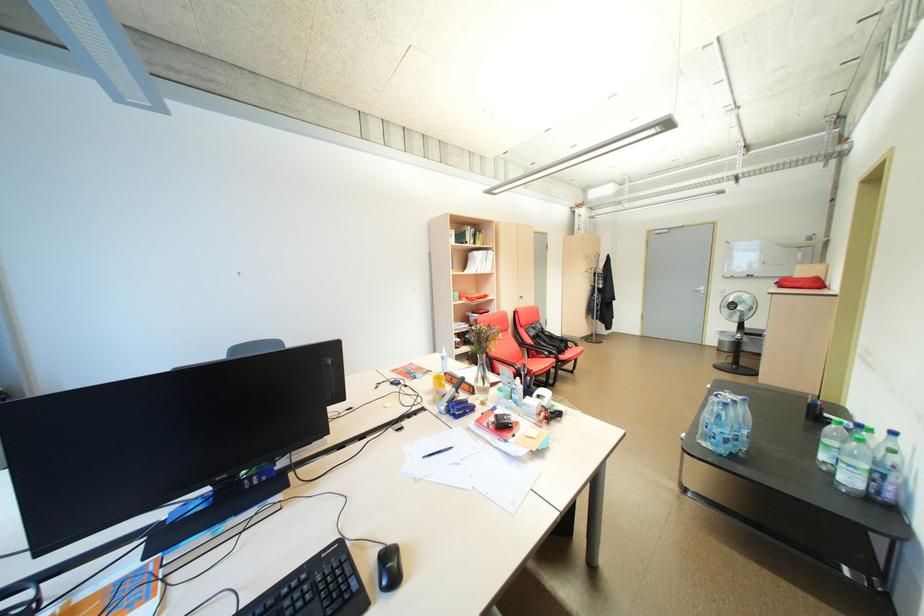
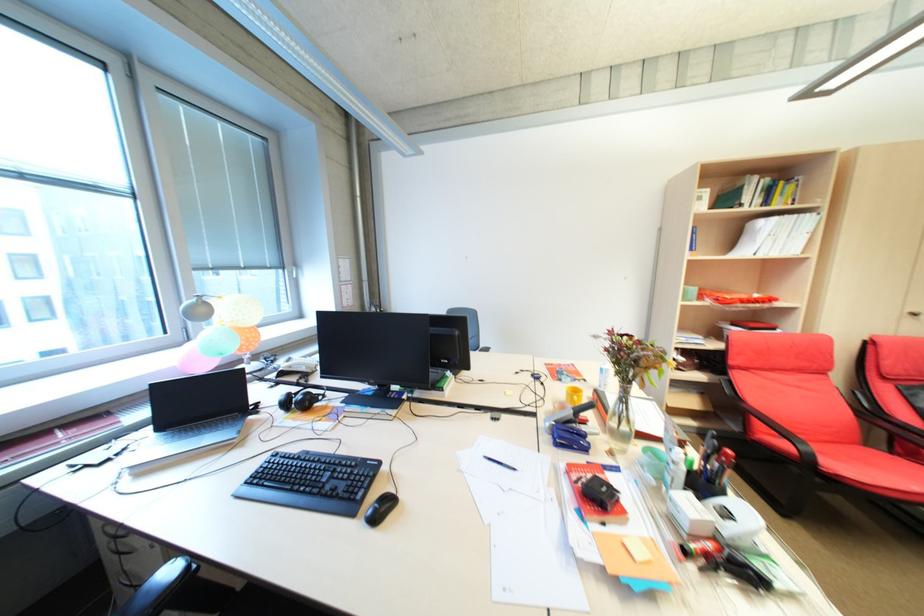
In the second image, find the point that corresponds to (310,585) in the first image.

(359, 467)